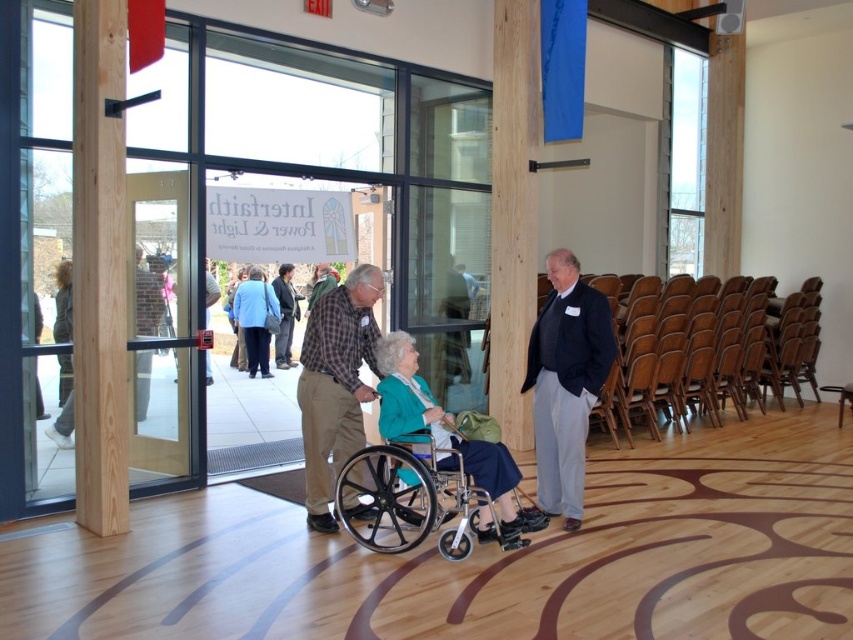
Is natural wood pillar at left above plaid shirt at center?

Indeed, natural wood pillar at left is positioned over plaid shirt at center.

Does natural wood pillar at left have a smaller size compared to plaid shirt at center?

Yes.

Does point (122, 74) come behind point (366, 362)?

That is False.

The height and width of the screenshot is (640, 853). Find the location of `natural wood pillar at left`. natural wood pillar at left is located at coordinates (100, 266).

Who is taller, wooden pillar at center or dark gray suit at center?

wooden pillar at center

Is point (525, 154) less distant than point (554, 292)?

No, it is behind (554, 292).

Who is more distant from viewer, (x=525, y=349) or (x=548, y=470)?

The point (x=525, y=349) is behind.

Locate an element on the screen. Image resolution: width=853 pixels, height=640 pixels. wooden pillar at center is located at coordinates (514, 211).

Is point (566, 262) positioned after point (263, 374)?

No, (566, 262) is closer to viewer.

How distant is dark gray suit at center from blue fabric coat at center?

A distance of 8.73 meters exists between dark gray suit at center and blue fabric coat at center.

Is point (573, 362) closer to camera compared to point (247, 349)?

Yes, it is in front of point (247, 349).

The width and height of the screenshot is (853, 640). Identify the location of dark gray suit at center. pyautogui.click(x=566, y=381).